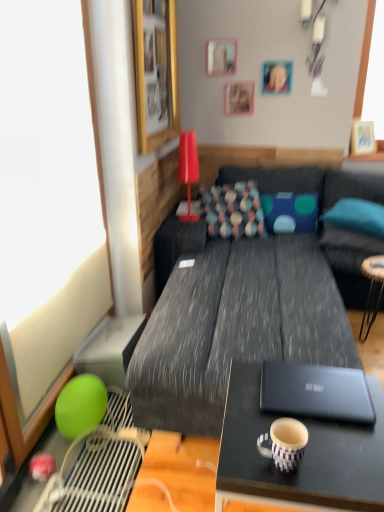
Question: From a real-world perspective, is wooden picture frame at upper center, which is the 5th picture frame from front to back, located higher than teal fabric bean bag chair at right?

Choices:
 (A) no
 (B) yes

Answer: (B)

Question: Considering the relative positions of wooden picture frame at upper center, which is the 5th picture frame from front to back, and teal fabric bean bag chair at right in the image provided, is wooden picture frame at upper center, which is the 5th picture frame from front to back, to the left of teal fabric bean bag chair at right from the viewer's perspective?

Choices:
 (A) no
 (B) yes

Answer: (B)

Question: Is teal fabric bean bag chair at right at the back of wooden picture frame at upper center, the 1th picture frame positioned from the back?

Choices:
 (A) no
 (B) yes

Answer: (A)

Question: Is wooden picture frame at upper center, the 1th picture frame positioned from the back, located outside teal fabric bean bag chair at right?

Choices:
 (A) yes
 (B) no

Answer: (A)

Question: Does wooden picture frame at upper center, which is the 5th picture frame from front to back, have a lesser width compared to teal fabric bean bag chair at right?

Choices:
 (A) no
 (B) yes

Answer: (B)

Question: From a real-world perspective, is wooden picture frame at upper center, which is the 5th picture frame from front to back, below teal fabric bean bag chair at right?

Choices:
 (A) yes
 (B) no

Answer: (B)

Question: Does green matte balloon at left come behind blue dotted pillow at right, which is the 3th pillow from left to right?

Choices:
 (A) no
 (B) yes

Answer: (A)

Question: Is blue dotted pillow at right, which is the 3th pillow from left to right, located within green matte balloon at left?

Choices:
 (A) no
 (B) yes

Answer: (A)

Question: From a real-world perspective, is green matte balloon at left physically below blue dotted pillow at right, marked as the 1th pillow in a right-to-left arrangement?

Choices:
 (A) yes
 (B) no

Answer: (B)

Question: From a real-world perspective, is green matte balloon at left on blue dotted pillow at right, marked as the 1th pillow in a right-to-left arrangement?

Choices:
 (A) no
 (B) yes

Answer: (B)

Question: Is green matte balloon at left to the right of blue dotted pillow at right, marked as the 1th pillow in a right-to-left arrangement, from the viewer's perspective?

Choices:
 (A) yes
 (B) no

Answer: (B)

Question: Would you say green matte balloon at left is a long distance from blue dotted pillow at right, marked as the 1th pillow in a right-to-left arrangement?

Choices:
 (A) yes
 (B) no

Answer: (A)

Question: Is wooden picture frame at upper right, placed as the 2th picture frame when sorted from back to front, looking in the opposite direction of blue dotted pillow at right, marked as the 1th pillow in a right-to-left arrangement?

Choices:
 (A) yes
 (B) no

Answer: (B)